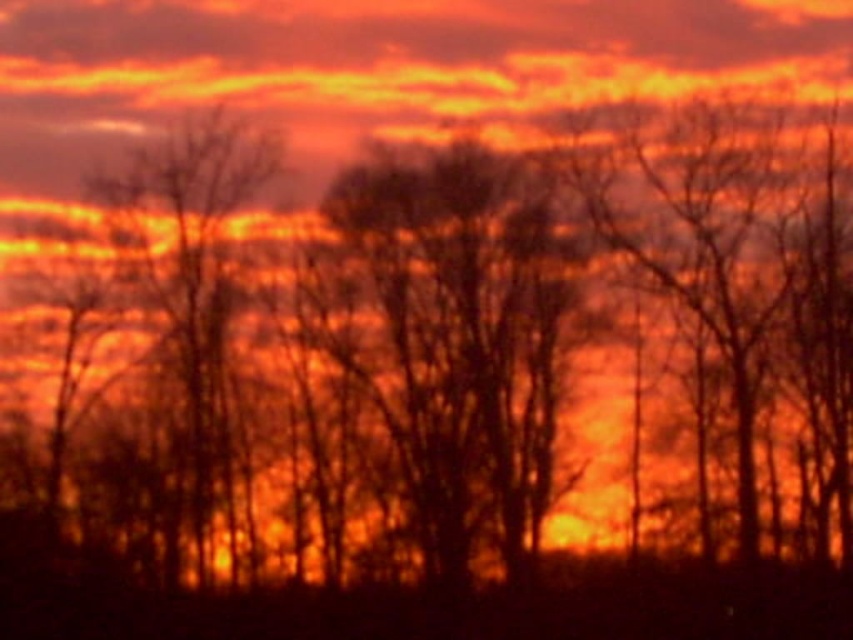
Question: Can you confirm if silhouette tree at center is positioned below matte orange cloud at upper center?

Choices:
 (A) yes
 (B) no

Answer: (A)

Question: Which of the following is the farthest from the observer?

Choices:
 (A) (476, 477)
 (B) (276, 3)

Answer: (B)

Question: Among these objects, which one is farthest from the camera?

Choices:
 (A) silhouette tree at center
 (B) matte orange cloud at upper center

Answer: (B)

Question: Is silhouette tree at center to the left of matte orange cloud at upper center from the viewer's perspective?

Choices:
 (A) yes
 (B) no

Answer: (B)

Question: Does silhouette tree at center come in front of matte orange cloud at upper center?

Choices:
 (A) no
 (B) yes

Answer: (B)

Question: Which point is closer to the camera?

Choices:
 (A) silhouette tree at center
 (B) matte orange cloud at upper center

Answer: (A)